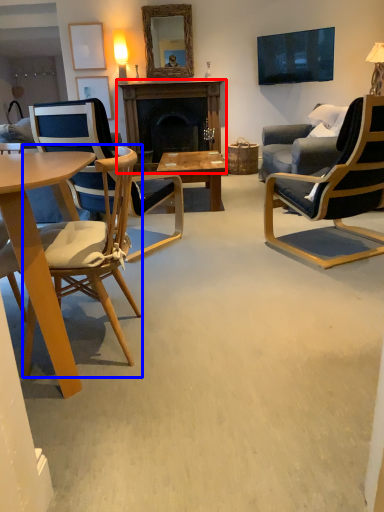
Question: Which object is further to the camera taking this photo, fireplace (highlighted by a red box) or chair (highlighted by a blue box)?

Choices:
 (A) fireplace
 (B) chair

Answer: (A)